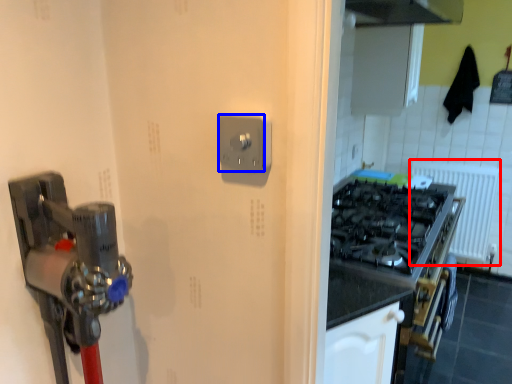
Question: Which of the following is the farthest to the observer, radiator (highlighted by a red box) or light switch (highlighted by a blue box)?

Choices:
 (A) radiator
 (B) light switch

Answer: (A)